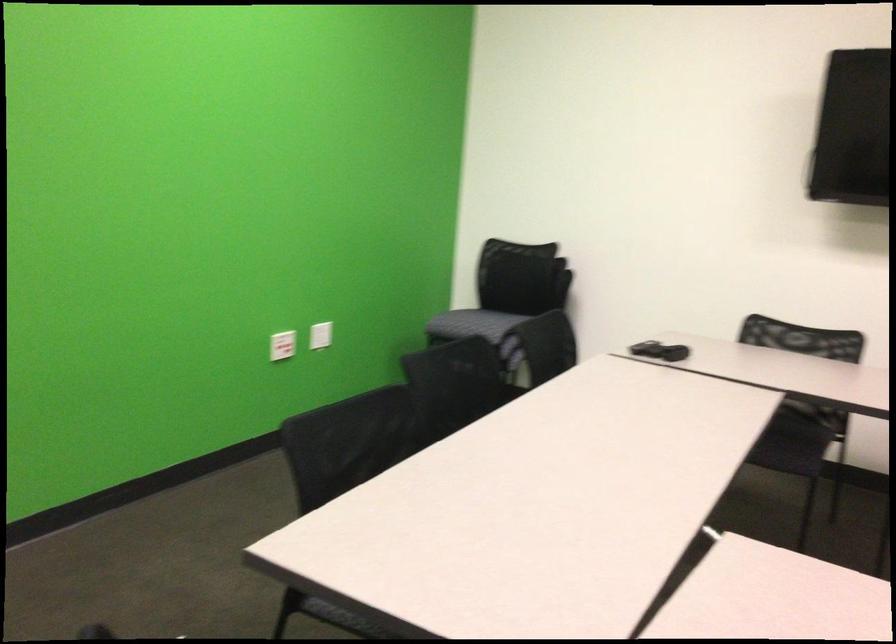
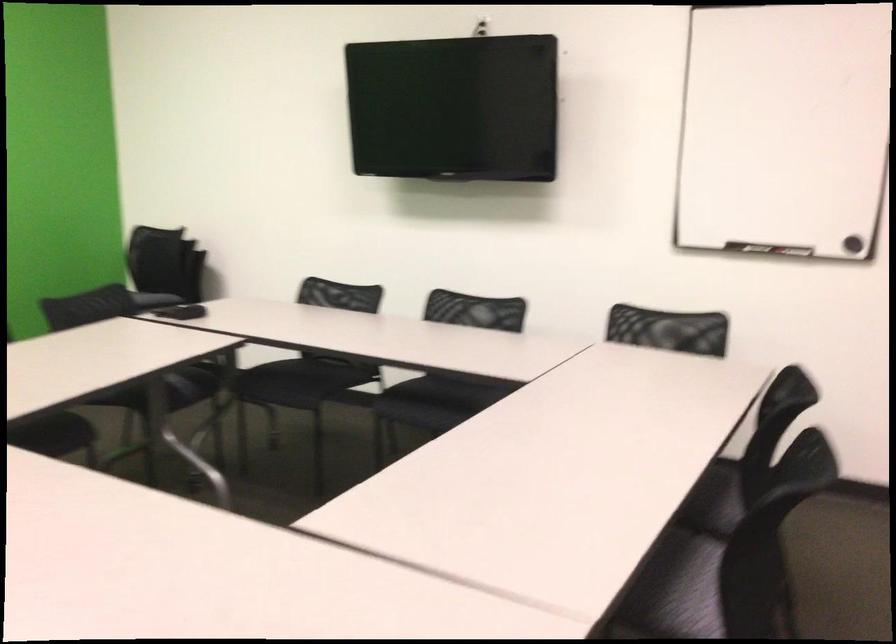
Question: Which direction would the cameraman need to move to produce the second image? Reply with the corresponding letter.

Choices:
 (A) Left
 (B) Right
 (C) Forward
 (D) Backward

Answer: (B)